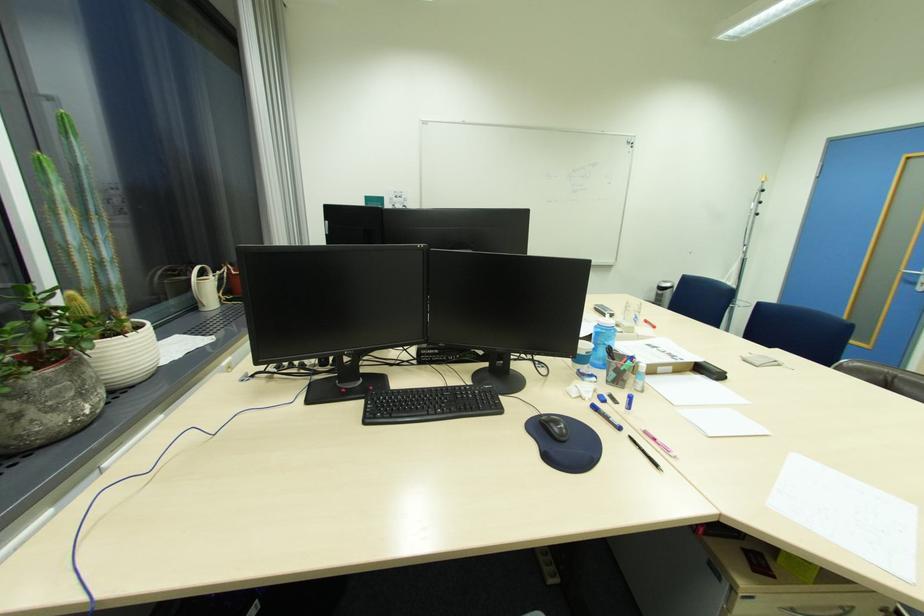
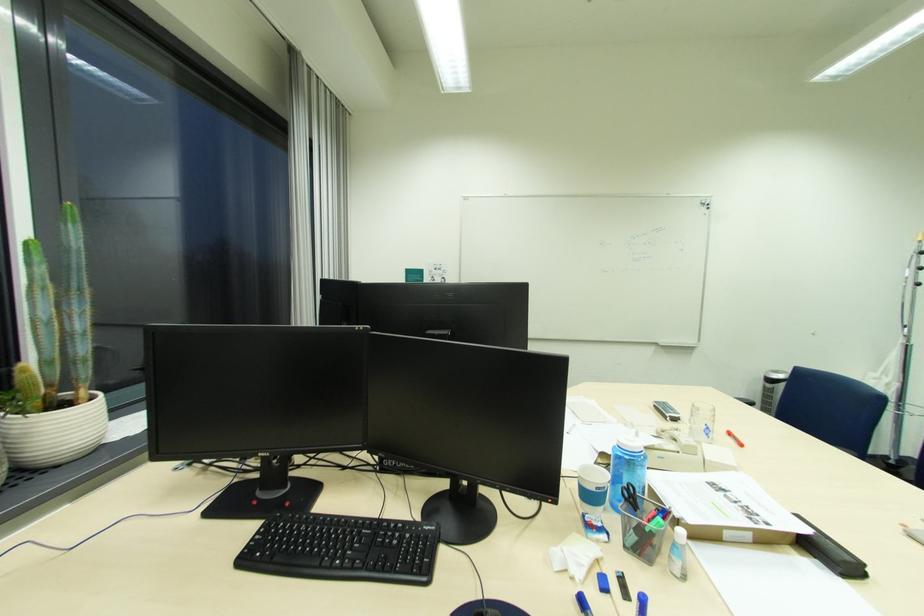
In the second image, find the point that corresponds to pixel 590 354 in the first image.

(600, 488)